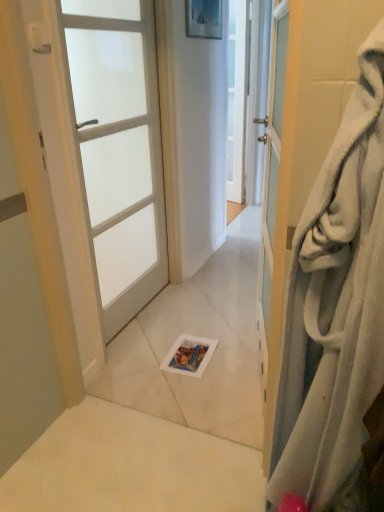
Find the location of `free spot to the right of white frosted glass door at left, which is the first door in left-to-right order`. free spot to the right of white frosted glass door at left, which is the first door in left-to-right order is located at coordinates (194, 321).